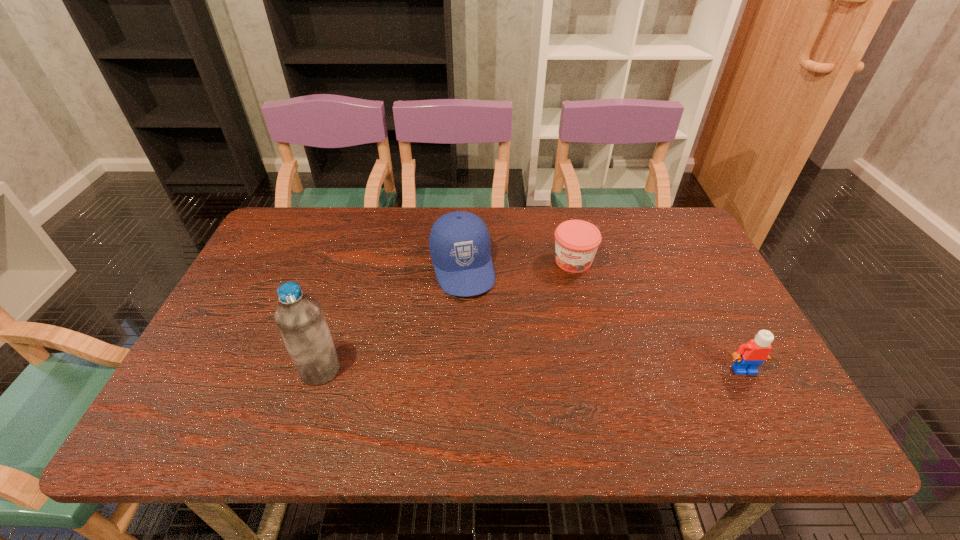
Identify the location of free area in between the jam and the leftmost object. The width and height of the screenshot is (960, 540). (446, 315).

Find the location of a particular element. The image size is (960, 540). free space between the shortest object and the rightmost object is located at coordinates (659, 315).

The height and width of the screenshot is (540, 960). In order to click on vacant space in between the tallest object and the Lego in this screenshot , I will do `click(532, 370)`.

This screenshot has height=540, width=960. Identify the location of vacant point located between the third object from left to right and the leftmost object. (446, 315).

The image size is (960, 540). What are the coordinates of `free space between the Lego and the second object from left to right` in the screenshot? It's located at (603, 319).

Where is `free space between the third object from right to left and the Lego`? The height and width of the screenshot is (540, 960). free space between the third object from right to left and the Lego is located at coordinates (603, 319).

Locate which object is the third closest to the cap. Please provide its 2D coordinates. Your answer should be formatted as a tuple, i.e. [(x, y)], where the tuple contains the x and y coordinates of a point satisfying the conditions above.

[(748, 357)]

Locate which object ranks in proximity to the second object from left to right. Please provide its 2D coordinates. Your answer should be formatted as a tuple, i.e. [(x, y)], where the tuple contains the x and y coordinates of a point satisfying the conditions above.

[(576, 241)]